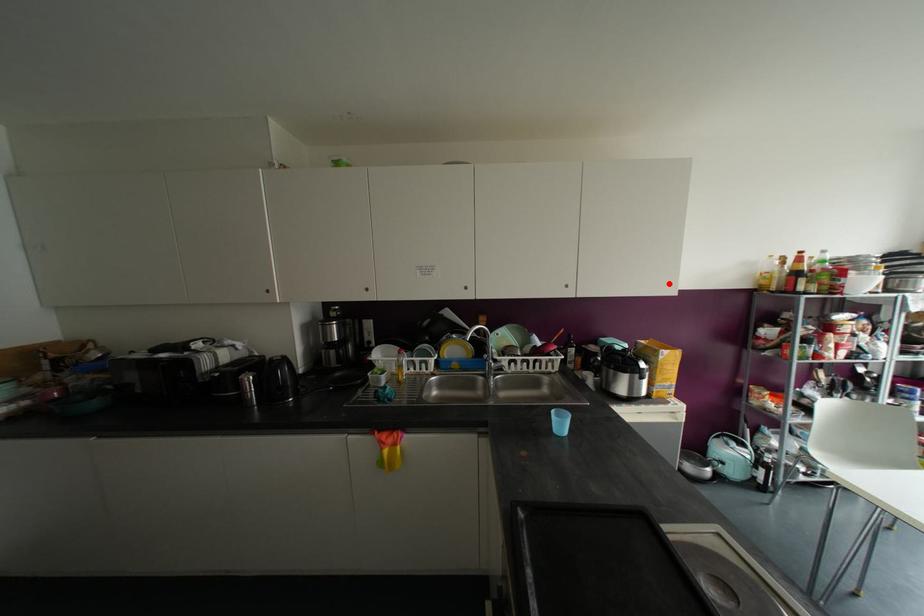
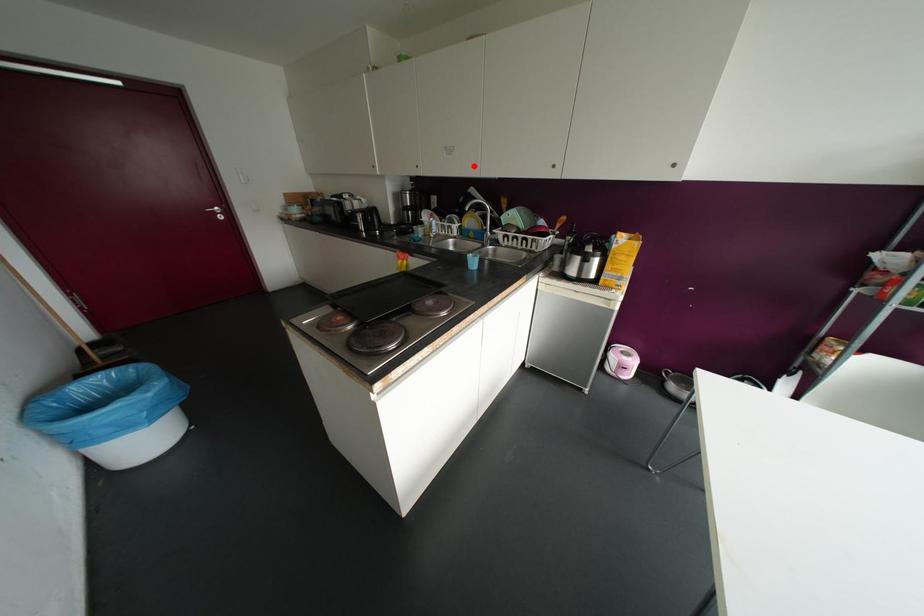
I am providing you with two images of the same scene from different viewpoints. A red point is marked on the first image and another point is marked on the second image. Are the points marked in image1 and image2 representing the same 3D position?

No